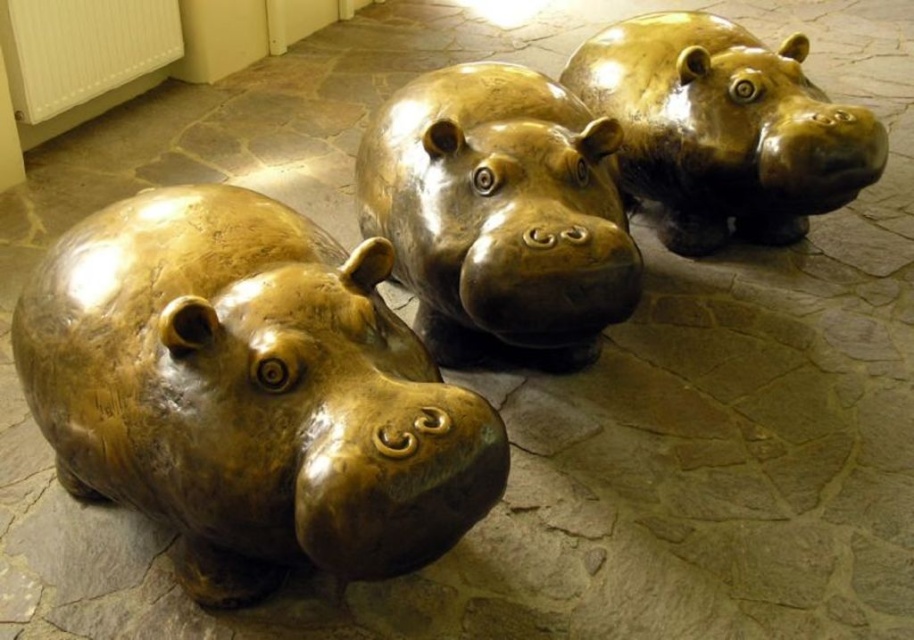
Question: Which object appears farthest from the camera in this image?

Choices:
 (A) gold polished hippo at upper right
 (B) gold polished hippo at center

Answer: (A)

Question: Is gold-bronze hippo at left above gold polished hippo at center?

Choices:
 (A) no
 (B) yes

Answer: (A)

Question: Does gold-bronze hippo at left appear on the right side of gold polished hippo at upper right?

Choices:
 (A) yes
 (B) no

Answer: (B)

Question: Among these objects, which one is nearest to the camera?

Choices:
 (A) gold polished hippo at upper right
 (B) gold polished hippo at center

Answer: (B)

Question: Is gold-bronze hippo at left to the left of gold polished hippo at upper right from the viewer's perspective?

Choices:
 (A) no
 (B) yes

Answer: (B)

Question: Estimate the real-world distances between objects in this image. Which object is farther from the gold-bronze hippo at left?

Choices:
 (A) gold polished hippo at center
 (B) gold polished hippo at upper right

Answer: (B)